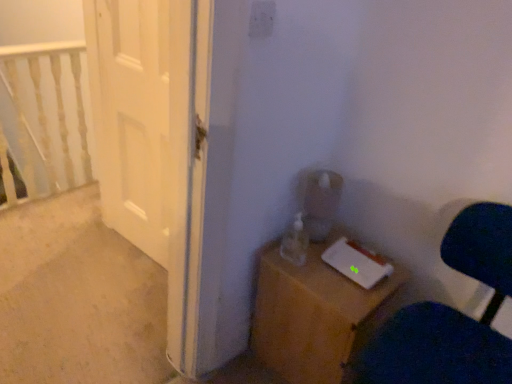
Question: Considering the relative sizes of wooden nightstand at lower right and velvet dark blue chair at lower right in the image provided, is wooden nightstand at lower right thinner than velvet dark blue chair at lower right?

Choices:
 (A) yes
 (B) no

Answer: (A)

Question: Considering the relative sizes of wooden nightstand at lower right and velvet dark blue chair at lower right in the image provided, is wooden nightstand at lower right shorter than velvet dark blue chair at lower right?

Choices:
 (A) no
 (B) yes

Answer: (B)

Question: From a real-world perspective, does wooden nightstand at lower right stand above velvet dark blue chair at lower right?

Choices:
 (A) no
 (B) yes

Answer: (A)

Question: Can you confirm if wooden nightstand at lower right is bigger than velvet dark blue chair at lower right?

Choices:
 (A) no
 (B) yes

Answer: (A)

Question: Considering the relative positions of wooden nightstand at lower right and velvet dark blue chair at lower right in the image provided, is wooden nightstand at lower right to the right of velvet dark blue chair at lower right from the viewer's perspective?

Choices:
 (A) yes
 (B) no

Answer: (B)

Question: Is wooden nightstand at lower right positioned with its back to velvet dark blue chair at lower right?

Choices:
 (A) yes
 (B) no

Answer: (B)

Question: Are white glossy door at left and wooden nightstand at lower right far apart?

Choices:
 (A) yes
 (B) no

Answer: (B)

Question: From a real-world perspective, is white glossy door at left on wooden nightstand at lower right?

Choices:
 (A) no
 (B) yes

Answer: (B)

Question: Does white glossy door at left have a lesser height compared to wooden nightstand at lower right?

Choices:
 (A) no
 (B) yes

Answer: (A)

Question: Can we say white glossy door at left lies outside wooden nightstand at lower right?

Choices:
 (A) yes
 (B) no

Answer: (A)

Question: Can wooden nightstand at lower right be found inside white glossy door at left?

Choices:
 (A) no
 (B) yes

Answer: (A)

Question: Is white glossy door at left closer to the viewer compared to wooden nightstand at lower right?

Choices:
 (A) yes
 (B) no

Answer: (B)

Question: Is velvet dark blue chair at lower right looking in the opposite direction of white painted wood railing at upper left?

Choices:
 (A) yes
 (B) no

Answer: (B)